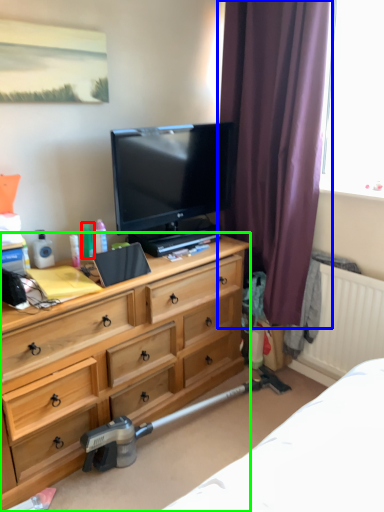
Question: Based on their relative distances, which object is farther from toiletry (highlighted by a red box)? Choose from curtain (highlighted by a blue box) and chest of drawers (highlighted by a green box).

Choices:
 (A) curtain
 (B) chest of drawers

Answer: (A)